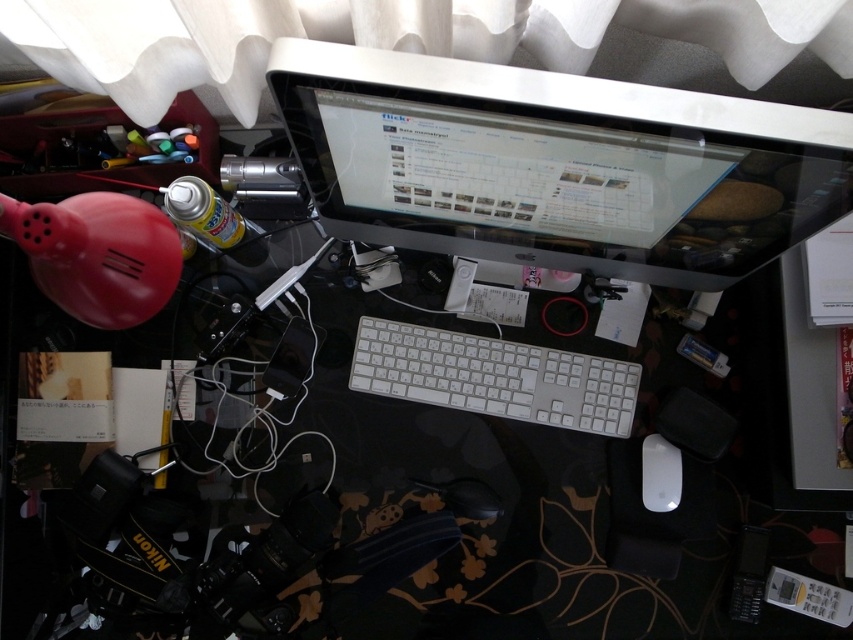
Based on the photo, does sleek silver monitor at upper center appear under white matte mouse at lower right?

Incorrect, sleek silver monitor at upper center is not positioned below white matte mouse at lower right.

Does sleek silver monitor at upper center come in front of white matte mouse at lower right?

Yes, it is in front of white matte mouse at lower right.

The image size is (853, 640). What do you see at coordinates (556, 164) in the screenshot?
I see `sleek silver monitor at upper center` at bounding box center [556, 164].

This screenshot has height=640, width=853. I want to click on sleek silver monitor at upper center, so click(x=556, y=164).

Is white plastic keyboard at center in front of white matte mouse at lower right?

No, white plastic keyboard at center is further to the viewer.

Does white plastic keyboard at center appear over white matte mouse at lower right?

Correct, white plastic keyboard at center is located above white matte mouse at lower right.

Where is `white plastic keyboard at center`? Image resolution: width=853 pixels, height=640 pixels. white plastic keyboard at center is located at coordinates (494, 376).

Image resolution: width=853 pixels, height=640 pixels. What do you see at coordinates (556, 164) in the screenshot? I see `sleek silver monitor at upper center` at bounding box center [556, 164].

Is point (454, 252) farther from camera compared to point (566, 387)?

That is False.

Which is in front, point (514, 224) or point (627, 428)?

Positioned in front is point (514, 224).

Image resolution: width=853 pixels, height=640 pixels. Identify the location of sleek silver monitor at upper center. (556, 164).